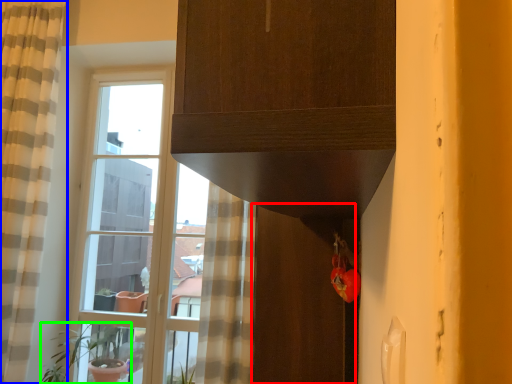
Question: Based on their relative distances, which object is farther from screen door (highlighted by a red box)? Choose from curtain (highlighted by a blue box) and houseplant (highlighted by a green box).

Choices:
 (A) curtain
 (B) houseplant

Answer: (B)